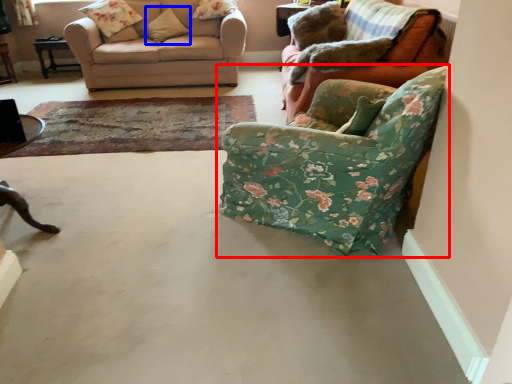
Question: Which object appears closest to the camera in this image, chair (highlighted by a red box) or pillow (highlighted by a blue box)?

Choices:
 (A) chair
 (B) pillow

Answer: (A)